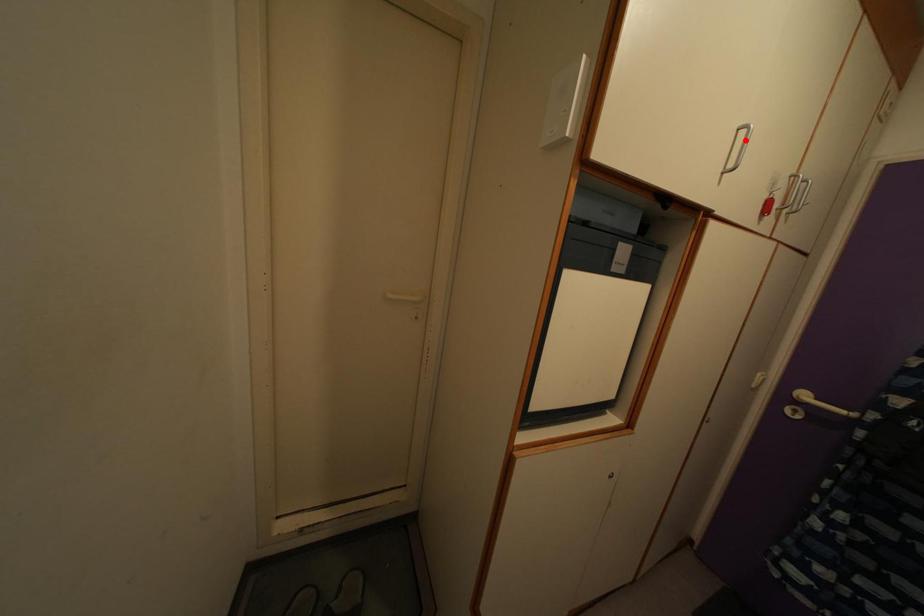
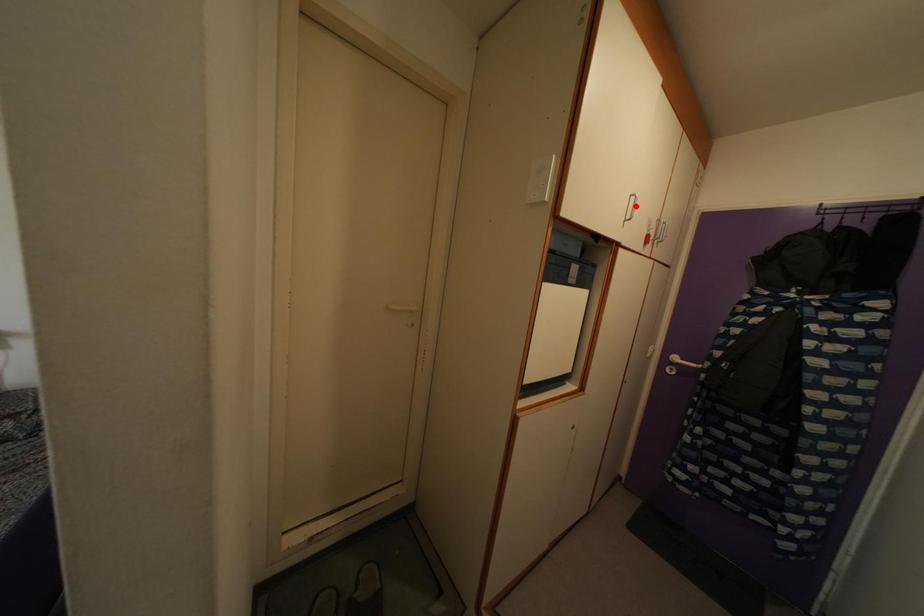
I am providing you with two images of the same scene from different viewpoints. A red point is marked on the first image and another point is marked on the second image. Do the highlighted points in image1 and image2 indicate the same real-world spot?

Yes